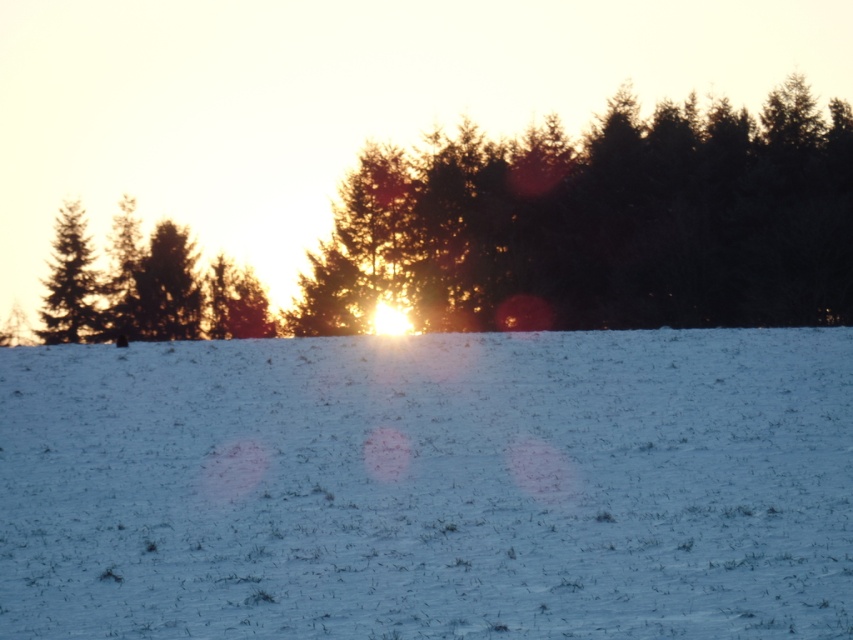
Question: Can you confirm if white matte snow at center is thinner than green matte tree at left?

Choices:
 (A) yes
 (B) no

Answer: (B)

Question: Is white matte snow at center above green matte tree at left?

Choices:
 (A) no
 (B) yes

Answer: (A)

Question: Based on their relative distances, which object is nearer to the silvery metallic trees at center?

Choices:
 (A) white matte snow at center
 (B) green matte tree at left

Answer: (B)

Question: Estimate the real-world distances between objects in this image. Which object is closer to the white matte snow at center?

Choices:
 (A) green matte tree at left
 (B) silvery metallic trees at center

Answer: (B)

Question: Which point is farther to the camera?

Choices:
 (A) silvery metallic trees at center
 (B) green matte tree at left

Answer: (B)

Question: Can you confirm if silvery metallic trees at center is positioned below green matte tree at left?

Choices:
 (A) yes
 (B) no

Answer: (B)